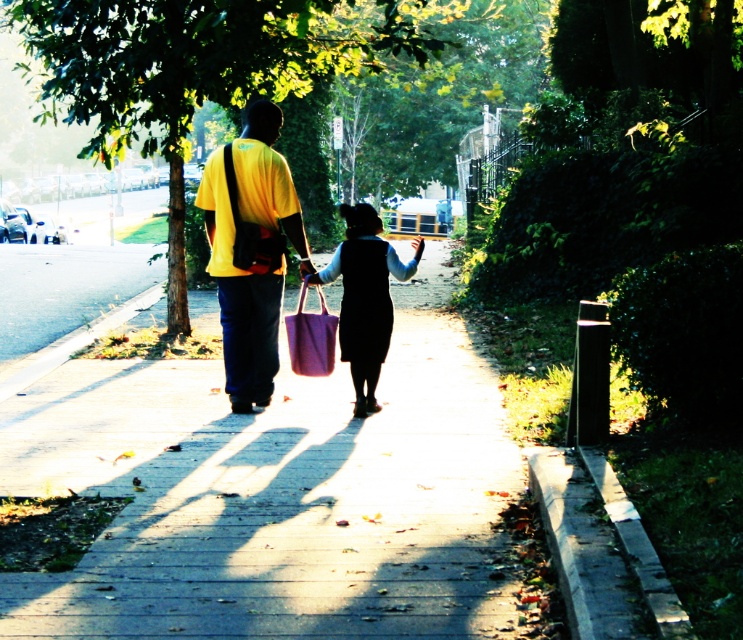
Who is shorter, yellow matte shirt at center or matte purple bag at center?

Standing shorter between the two is matte purple bag at center.

Can you confirm if yellow matte shirt at center is positioned to the left of matte purple bag at center?

Correct, you'll find yellow matte shirt at center to the left of matte purple bag at center.

Which is in front, point (239, 337) or point (363, 209)?

Point (239, 337) is more forward.

In order to click on yellow matte shirt at center in this screenshot , I will do `click(250, 259)`.

Between point (272, 429) and point (376, 356), which one is positioned in front?

Positioned in front is point (272, 429).

Who is taller, smooth concrete sidewalk at center or matte purple bag at center?

With more height is smooth concrete sidewalk at center.

Where is `smooth concrete sidewalk at center`? The height and width of the screenshot is (640, 743). smooth concrete sidewalk at center is located at coordinates (276, 496).

This screenshot has height=640, width=743. Find the location of `smooth concrete sidewalk at center`. smooth concrete sidewalk at center is located at coordinates (276, 496).

Which of these two, smooth concrete sidewalk at center or yellow matte shirt at center, stands shorter?

Standing shorter between the two is smooth concrete sidewalk at center.

Is smooth concrete sidewalk at center to the right of yellow matte shirt at center from the viewer's perspective?

Yes, smooth concrete sidewalk at center is to the right of yellow matte shirt at center.

The image size is (743, 640). Identify the location of smooth concrete sidewalk at center. (276, 496).